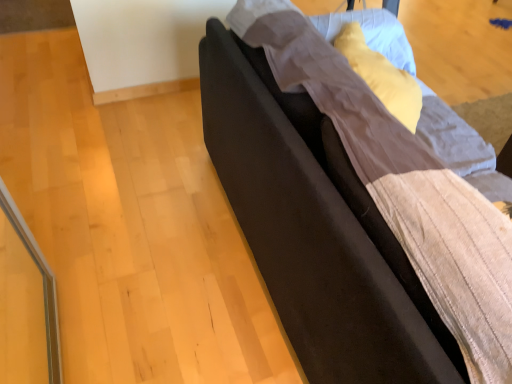
What do you see at coordinates (316, 229) in the screenshot?
I see `suede-like brown couch at center` at bounding box center [316, 229].

The image size is (512, 384). Find the location of `suede-like brown couch at center`. suede-like brown couch at center is located at coordinates (316, 229).

Locate an element on the screen. Image resolution: width=512 pixels, height=384 pixels. suede-like brown couch at center is located at coordinates (316, 229).